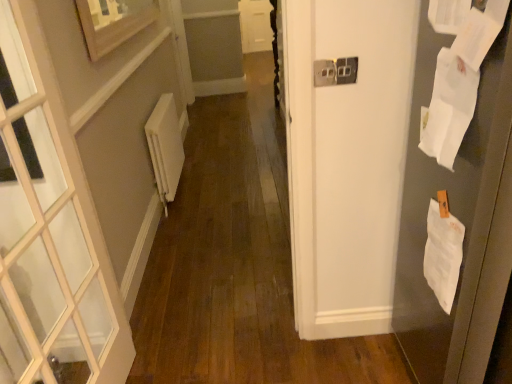
Question: Considering the positions of point (476, 26) and point (156, 9), is point (476, 26) closer or farther from the camera than point (156, 9)?

Choices:
 (A) closer
 (B) farther

Answer: (A)

Question: In terms of height, does white paper at upper right, arranged as the third paper when ordered from the bottom, look taller or shorter compared to wooden picture frame at upper left?

Choices:
 (A) tall
 (B) short

Answer: (B)

Question: Which object is the closest to the white paper at right, positioned as the 2th paper in bottom-to-top order?

Choices:
 (A) white paper at right, the 1th paper in the bottom-to-top sequence
 (B) white paper at right
 (C) white matte radiator at left
 (D) wooden picture frame at upper left
 (E) white plastic electric outlet at upper center

Answer: (B)

Question: Which of these objects is positioned farthest from the wooden picture frame at upper left?

Choices:
 (A) white paper at right
 (B) white matte radiator at left
 (C) white paper at right, positioned as the 2th paper in bottom-to-top order
 (D) white plastic electric outlet at upper center
 (E) white paper at right, the 1th paper in the bottom-to-top sequence

Answer: (E)